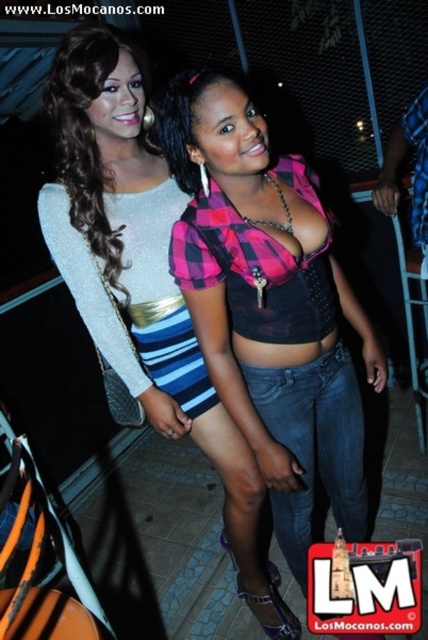
Can you confirm if pink plaid shirt at center is positioned to the left of matte black dress at center?

Incorrect, pink plaid shirt at center is not on the left side of matte black dress at center.

Does pink plaid shirt at center have a greater height compared to matte black dress at center?

No.

Is point (240, 212) in front of point (61, 100)?

That is True.

This screenshot has height=640, width=428. I want to click on pink plaid shirt at center, so click(269, 307).

Between pink plaid shirt at center and shiny silver purse at upper left, which one has less height?

With less height is shiny silver purse at upper left.

Describe the element at coordinates (269, 307) in the screenshot. I see `pink plaid shirt at center` at that location.

What do you see at coordinates (269, 307) in the screenshot? The width and height of the screenshot is (428, 640). I see `pink plaid shirt at center` at bounding box center [269, 307].

The height and width of the screenshot is (640, 428). Identify the location of pink plaid shirt at center. (269, 307).

Who is higher up, matte black dress at center or shiny silver purse at upper left?

shiny silver purse at upper left is higher up.

Does point (107, 195) lie behind point (101, 48)?

Yes.

Where is `matte black dress at center`? The height and width of the screenshot is (640, 428). matte black dress at center is located at coordinates (142, 282).

At what (x,y) coordinates should I click in order to perform the action: click on matte black dress at center. Please return your answer as a coordinate pair (x, y). This screenshot has width=428, height=640. Looking at the image, I should click on [142, 282].